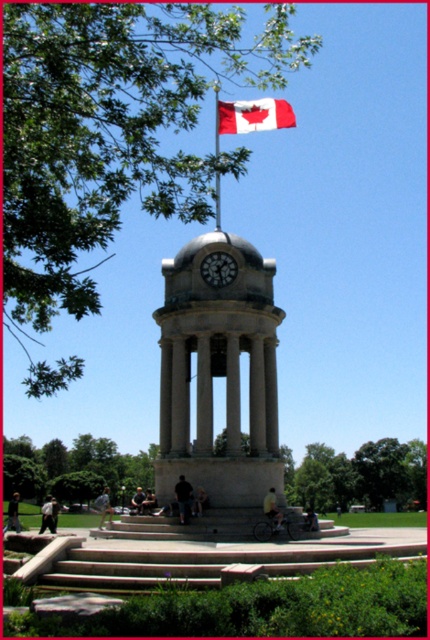
Looking at this image, can you confirm if white cotton flag at upper center is positioned to the right of metallic flag pole at upper center?

Yes, white cotton flag at upper center is to the right of metallic flag pole at upper center.

Can you confirm if white cotton flag at upper center is positioned below metallic flag pole at upper center?

Actually, white cotton flag at upper center is above metallic flag pole at upper center.

Is point (218, 100) closer to viewer compared to point (218, 109)?

No.

I want to click on white cotton flag at upper center, so click(254, 115).

Between matte gray clock at center and metallic flag pole at upper center, which one has less height?

With less height is matte gray clock at center.

Looking at this image, is the position of matte gray clock at center more distant than that of metallic flag pole at upper center?

Yes, it is behind metallic flag pole at upper center.

Who is more forward, (233, 260) or (218, 92)?

Point (233, 260) is in front.

Where is `matte gray clock at center`? This screenshot has width=430, height=640. matte gray clock at center is located at coordinates (218, 269).

The height and width of the screenshot is (640, 430). Find the location of `white marble clock tower at center`. white marble clock tower at center is located at coordinates (218, 372).

Find the location of a particular element. The height and width of the screenshot is (640, 430). white marble clock tower at center is located at coordinates (218, 372).